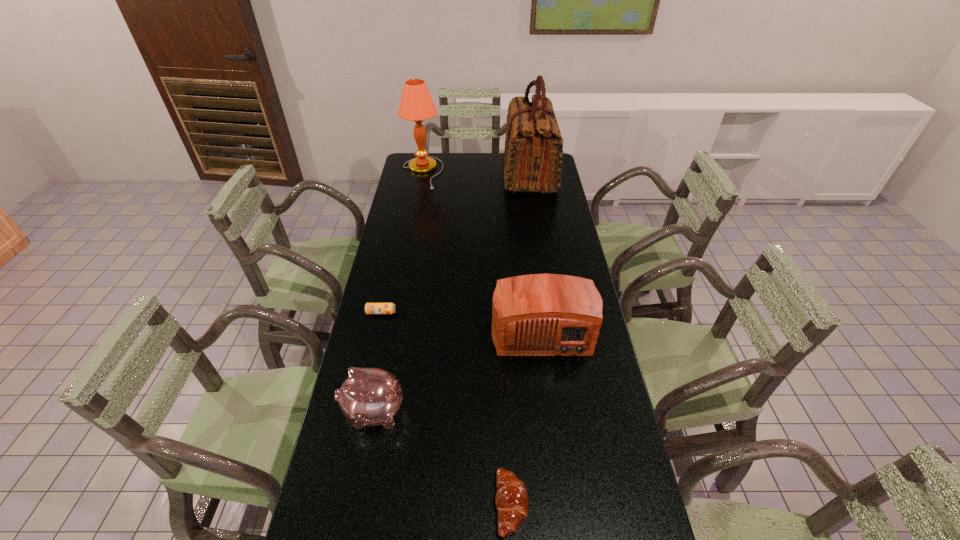
At what (x,y) coordinates should I click in order to perform the action: click on object that is at the far right corner. Please return your answer as a coordinate pair (x, y). The width and height of the screenshot is (960, 540). Looking at the image, I should click on (533, 149).

Identify the location of vacant space at the far edge. The width and height of the screenshot is (960, 540). (452, 171).

The height and width of the screenshot is (540, 960). What are the coordinates of `vacant space at the left edge` in the screenshot? It's located at (391, 293).

The height and width of the screenshot is (540, 960). Identify the location of vacant region at the right edge of the desktop. (586, 496).

Find the location of a particular element. unoccupied position between the third tallest object and the beer can is located at coordinates (461, 320).

The height and width of the screenshot is (540, 960). In order to click on vacant space that's between the shopping bag and the fourth shortest object in this screenshot , I will do `click(536, 251)`.

Identify the location of empty location between the shortest object and the radio receiver. The image size is (960, 540). (461, 320).

This screenshot has height=540, width=960. I want to click on vacant area that lies between the radio receiver and the beer can, so click(461, 320).

Locate an element on the screen. The width and height of the screenshot is (960, 540). free space between the lamp and the fourth tallest object is located at coordinates (398, 292).

Where is `the closest object relative to the lamp`? This screenshot has height=540, width=960. the closest object relative to the lamp is located at coordinates (533, 149).